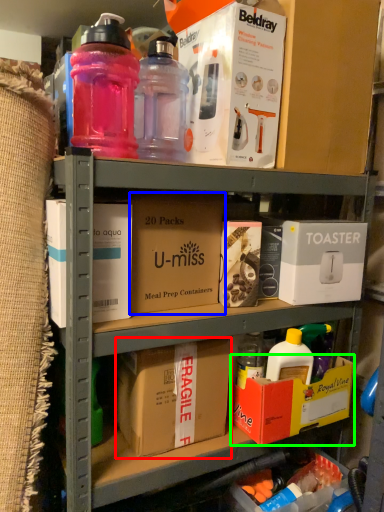
Question: Which object is the farthest from cardboard box (highlighted by a red box)? Choose among these: cardboard box (highlighted by a blue box) or box (highlighted by a green box).

Choices:
 (A) cardboard box
 (B) box

Answer: (A)